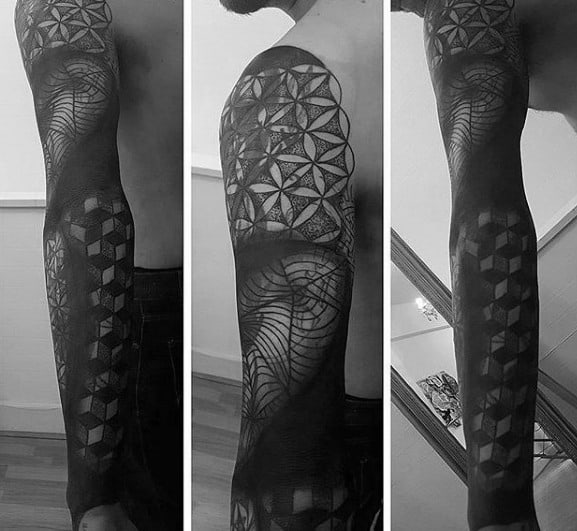
Find the location of a particular element. This screenshot has width=577, height=531. mirror frame is located at coordinates (426, 278).